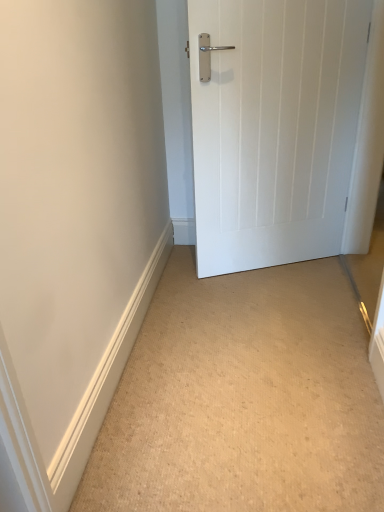
Find the location of a particular element. free space on the front side of white wooden door at right is located at coordinates (282, 308).